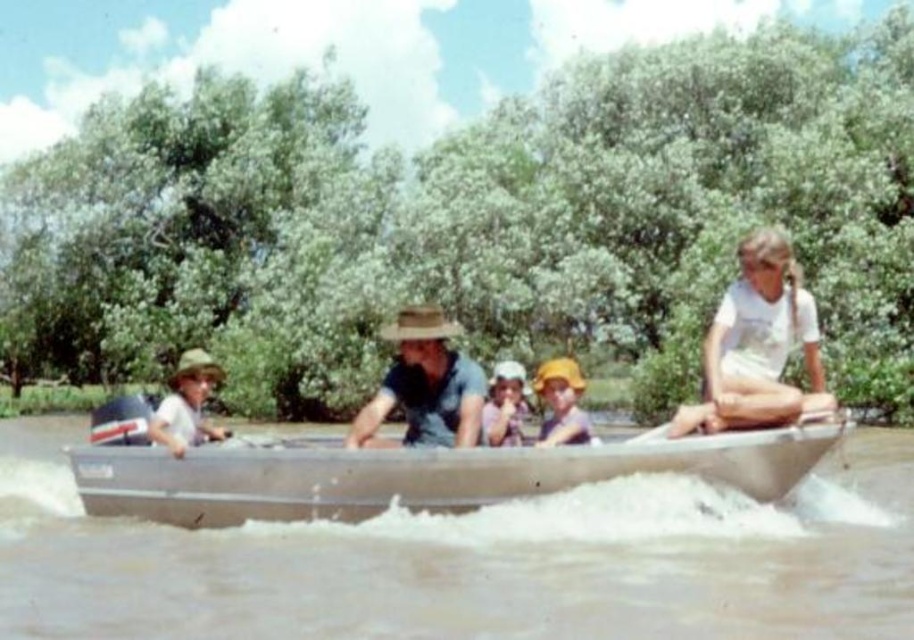
Consider the image. You are an observer standing on the riverbank watching the silver metallic boat at center and the brown woven hat at center. Which object is taller?

The silver metallic boat at center is not as tall as the brown woven hat at center, so the brown woven hat at center is taller.

You are standing on the riverbank and looking at the boat. There are two points marked on the boat. One is at coordinate point (245, 492) and the other is at point (445, 339). Which point is closer to you?

Point (245, 492) is closer to the viewer than point (445, 339).